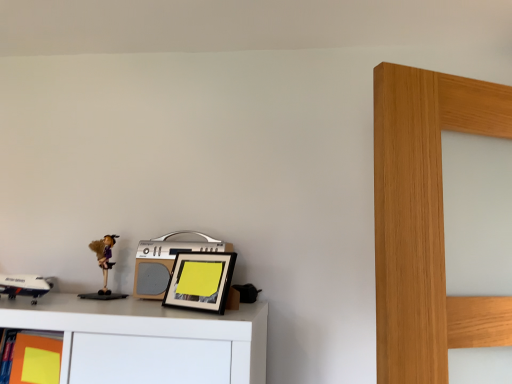
Question: Is silver metallic stereo at center surrounded by matte yellow sticky note at lower left?

Choices:
 (A) yes
 (B) no

Answer: (B)

Question: Can you confirm if matte yellow sticky note at lower left is smaller than silver metallic stereo at center?

Choices:
 (A) yes
 (B) no

Answer: (A)

Question: Does matte yellow sticky note at lower left appear on the left side of silver metallic stereo at center?

Choices:
 (A) no
 (B) yes

Answer: (B)

Question: Is matte yellow sticky note at lower left bigger than silver metallic stereo at center?

Choices:
 (A) no
 (B) yes

Answer: (A)

Question: Is matte yellow sticky note at lower left completely or partially outside of silver metallic stereo at center?

Choices:
 (A) no
 (B) yes

Answer: (B)

Question: Can you confirm if matte yellow sticky note at lower left is thinner than silver metallic stereo at center?

Choices:
 (A) no
 (B) yes

Answer: (B)

Question: Can you confirm if silver metallic stereo at center is positioned to the right of matte yellow sticky note at lower left?

Choices:
 (A) no
 (B) yes

Answer: (B)

Question: Can you see silver metallic stereo at center touching matte yellow sticky note at lower left?

Choices:
 (A) no
 (B) yes

Answer: (A)

Question: Does silver metallic stereo at center turn towards matte yellow sticky note at lower left?

Choices:
 (A) no
 (B) yes

Answer: (A)

Question: Is silver metallic stereo at center not close to matte yellow sticky note at lower left?

Choices:
 (A) no
 (B) yes

Answer: (A)

Question: Does silver metallic stereo at center have a greater width compared to matte yellow sticky note at lower left?

Choices:
 (A) yes
 (B) no

Answer: (A)

Question: From a real-world perspective, is silver metallic stereo at center on matte yellow sticky note at lower left?

Choices:
 (A) yes
 (B) no

Answer: (A)

Question: Is matte yellow sticky note at lower left turned away from matte purple doll at left?

Choices:
 (A) no
 (B) yes

Answer: (A)